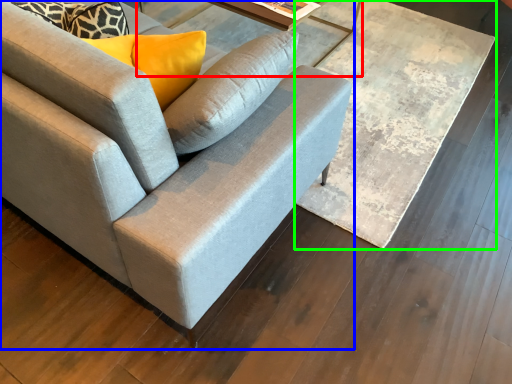
Question: Based on their relative distances, which object is farther from round table (highlighted by a red box)? Choose from studio couch (highlighted by a blue box) and table (highlighted by a green box).

Choices:
 (A) studio couch
 (B) table

Answer: (A)